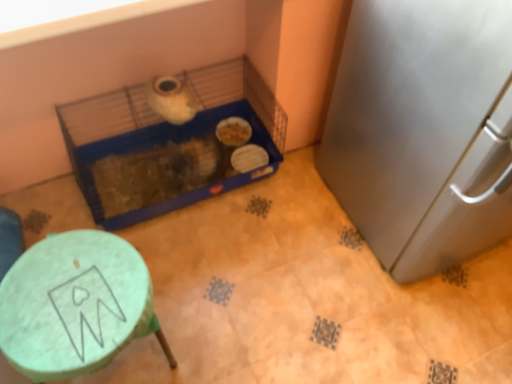
What are the coordinates of `vacant space to the right of dark brown textured bedding at center` in the screenshot? It's located at (198, 225).